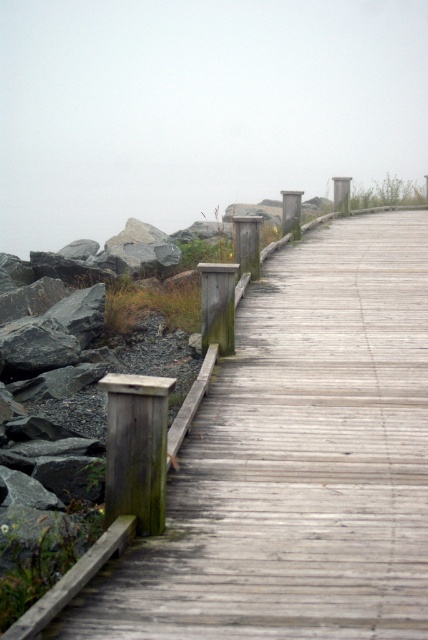
You are standing on the wooden boardwalk and looking towards the upper center of the scene. Which area takes up more visual space in the image, the weathered wood boardwalk at left or the foggy gray at upper center?

The foggy gray at upper center occupies more space than the weathered wood boardwalk at left according to the description.